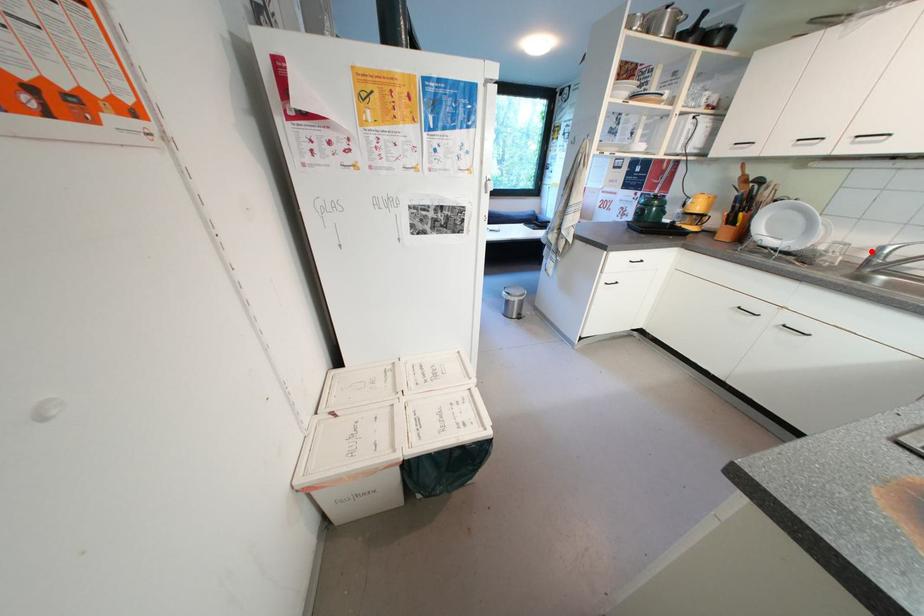
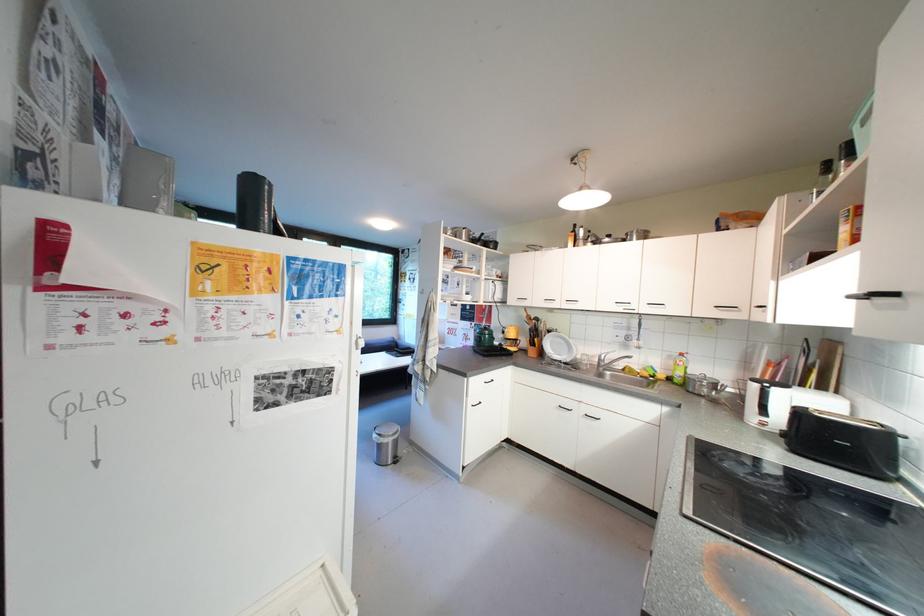
Where in the second image is the point corresponding to the highlighted location from the first image?

(602, 359)